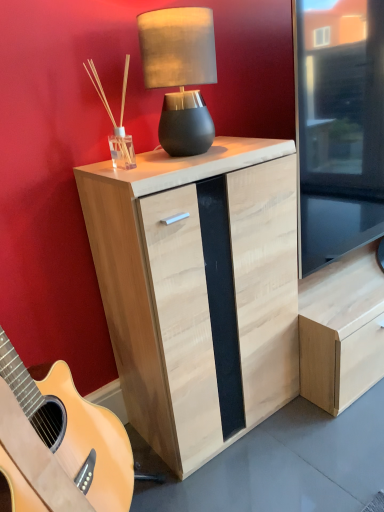
At what (x,y) coordinates should I click in order to perform the action: click on free space above natural wood cabinet at center (from a real-world perspective). Please return your answer as a coordinate pair (x, y). This screenshot has height=512, width=384. Looking at the image, I should click on (183, 153).